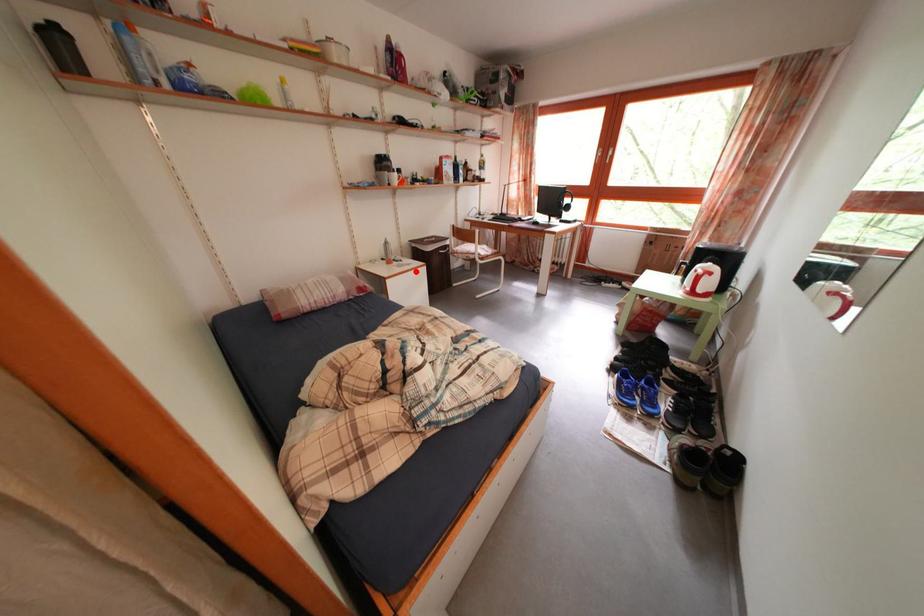
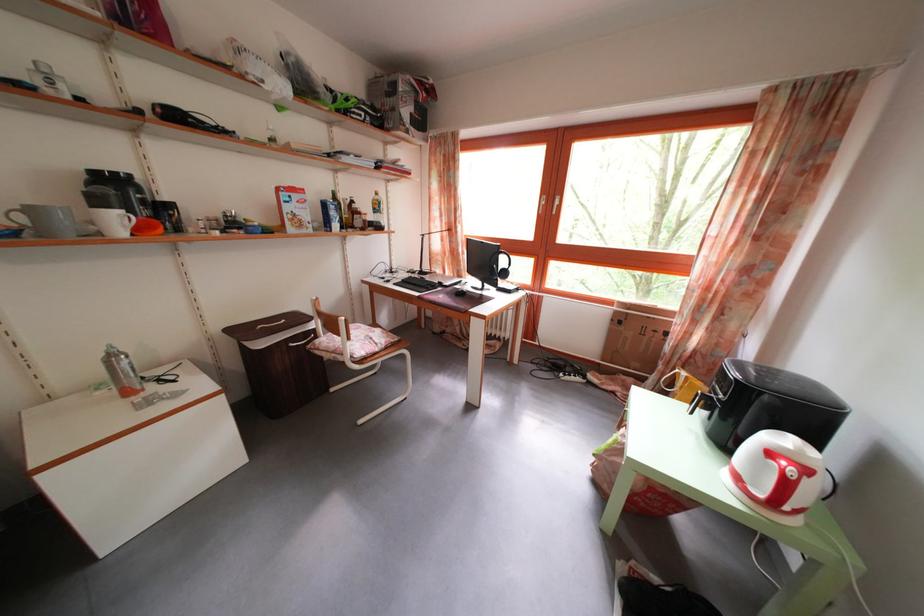
In the second image, find the point that corresponds to the highlighted location in the first image.

(185, 402)